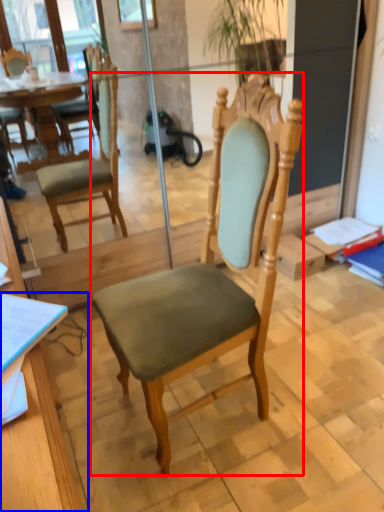
Question: Among these objects, which one is nearest to the camera, chair (highlighted by a red box) or desk (highlighted by a blue box)?

Choices:
 (A) chair
 (B) desk

Answer: (B)